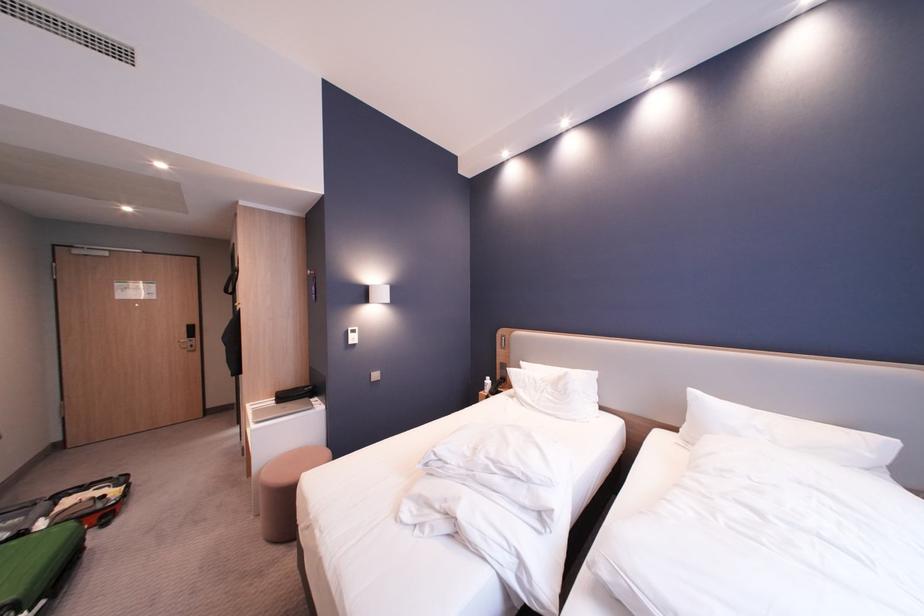
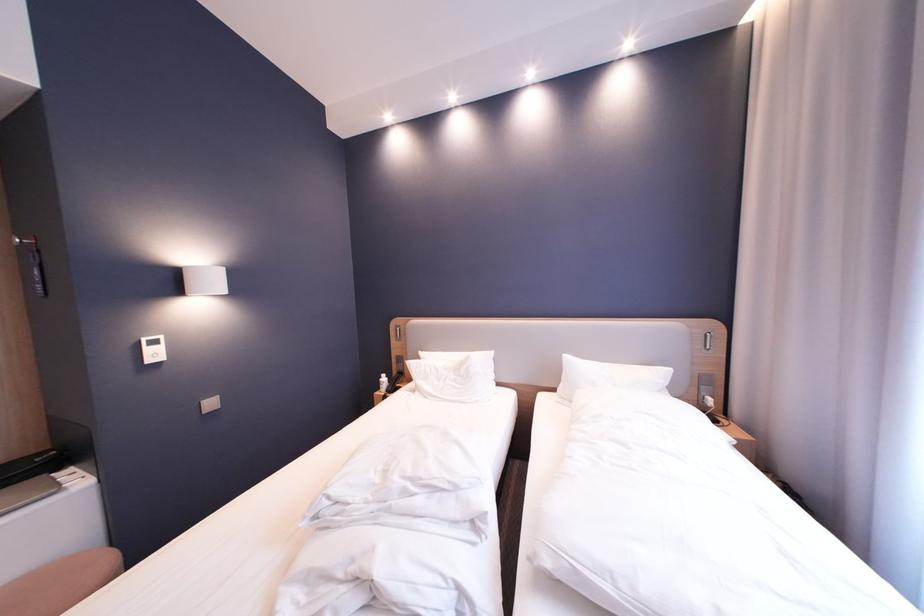
Question: The images are taken continuously from a first-person perspective. In which direction are you moving?

Choices:
 (A) Left
 (B) Right
 (C) Forward
 (D) Backward

Answer: (C)